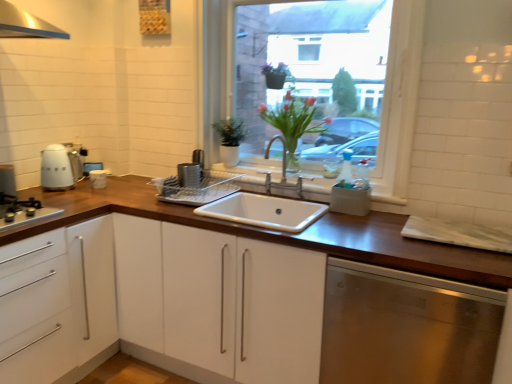
Question: Is matte white kettle at left in front of or behind stainless steel dishwasher at lower right in the image?

Choices:
 (A) front
 (B) behind

Answer: (B)

Question: From a real-world perspective, is matte white kettle at left positioned above or below stainless steel dishwasher at lower right?

Choices:
 (A) below
 (B) above

Answer: (B)

Question: Which of these objects is positioned farthest from the black matte gas stove at left?

Choices:
 (A) translucent glass vase at center
 (B) white ceramic sink at center
 (C) stainless steel dishwasher at lower right
 (D) white glossy cabinet at left, the 2th cabinetry viewed from the right
 (E) white matte cabinet at center, the first cabinetry in the right-to-left sequence

Answer: (C)

Question: Which object is positioned farthest from the stainless steel dishwasher at lower right?

Choices:
 (A) matte white kettle at left
 (B) black matte gas stove at left
 (C) translucent glass vase at center
 (D) white ceramic sink at center
 (E) white matte cabinet at center, which is the second cabinetry in left-to-right order

Answer: (A)